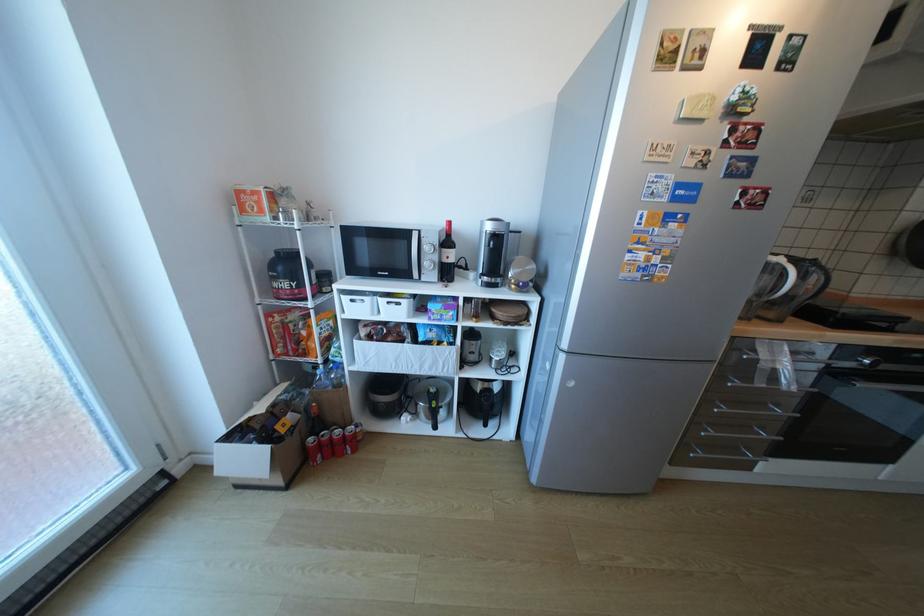
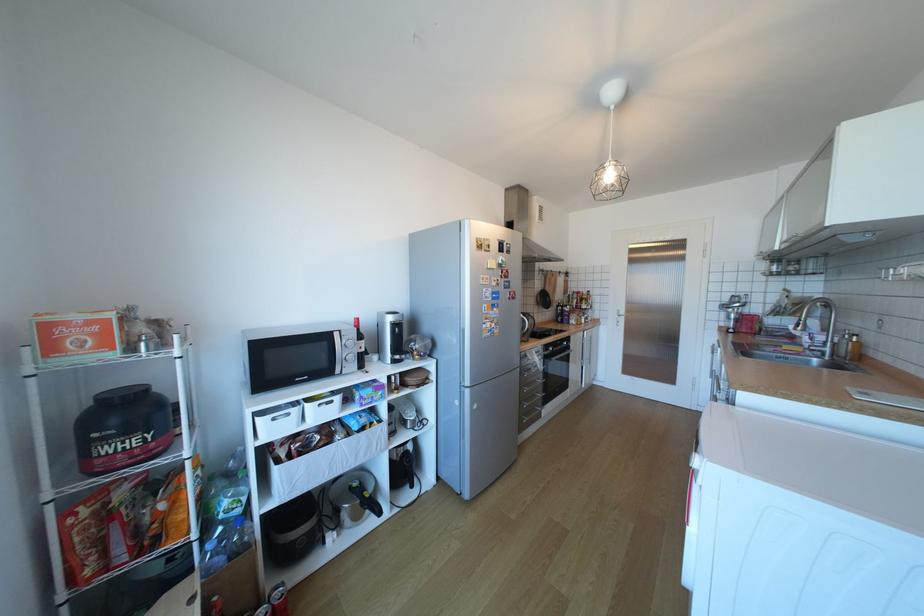
Where in the second image is the point corresponding to (407,304) from the first image?

(341, 402)